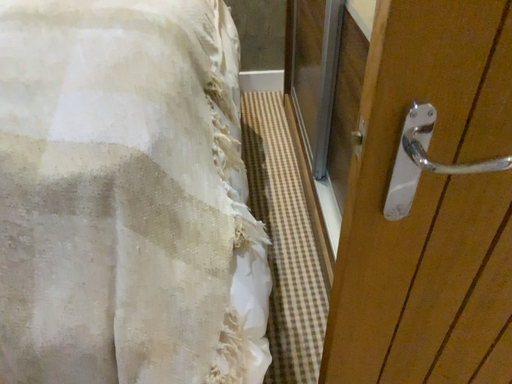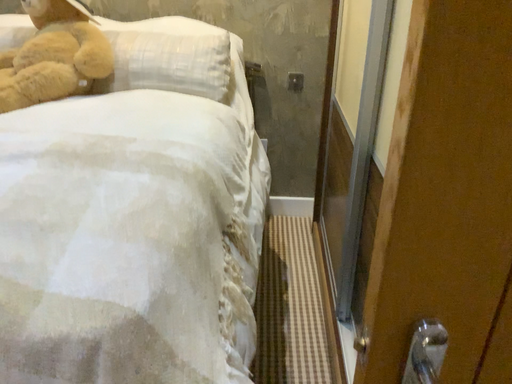
Question: Which way did the camera rotate in the video?

Choices:
 (A) rotated downward
 (B) rotated upward

Answer: (B)